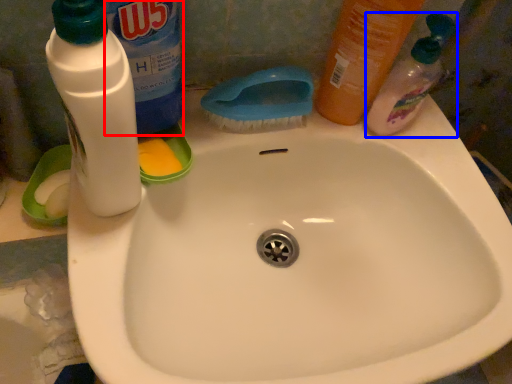
Question: Which object is further to the camera taking this photo, cleaning product (highlighted by a red box) or cleaning product (highlighted by a blue box)?

Choices:
 (A) cleaning product
 (B) cleaning product

Answer: (B)